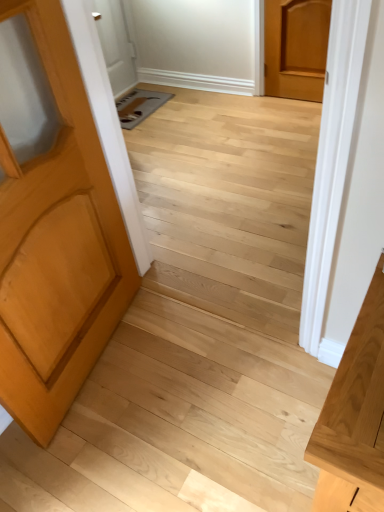
Question: Is the position of light brown wood door at left, positioned as the second door in back-to-front order, more distant than that of light wood vanity at right?

Choices:
 (A) no
 (B) yes

Answer: (A)

Question: From a real-world perspective, is light brown wood door at left, the 1th door viewed from the front, on light wood vanity at right?

Choices:
 (A) no
 (B) yes

Answer: (B)

Question: Is light brown wood door at left, positioned as the second door in back-to-front order, surrounding light wood vanity at right?

Choices:
 (A) yes
 (B) no

Answer: (B)

Question: Is light brown wood door at left, positioned as the second door in back-to-front order, oriented away from light wood vanity at right?

Choices:
 (A) yes
 (B) no

Answer: (B)

Question: Is light brown wood door at left, marked as the first door in a bottom-to-top arrangement, to the right of light wood vanity at right from the viewer's perspective?

Choices:
 (A) yes
 (B) no

Answer: (B)

Question: From the image's perspective, is light brown wood door at left, the 2th door positioned from the top, above or below light wood vanity at right?

Choices:
 (A) below
 (B) above

Answer: (B)

Question: Considering their positions, is light brown wood door at left, positioned as the second door in back-to-front order, located in front of or behind light wood vanity at right?

Choices:
 (A) front
 (B) behind

Answer: (A)

Question: In terms of height, does light brown wood door at left, the 1th door positioned from the left, look taller or shorter compared to light wood vanity at right?

Choices:
 (A) short
 (B) tall

Answer: (B)

Question: Considering the relative positions of light brown wood door at left, marked as the first door in a bottom-to-top arrangement, and light wood vanity at right in the image provided, is light brown wood door at left, marked as the first door in a bottom-to-top arrangement, to the left or to the right of light wood vanity at right?

Choices:
 (A) right
 (B) left

Answer: (B)

Question: Considering the relative positions of light brown wood door at upper right, acting as the first door starting from the back, and light wood vanity at right in the image provided, is light brown wood door at upper right, acting as the first door starting from the back, to the left or to the right of light wood vanity at right?

Choices:
 (A) left
 (B) right

Answer: (B)

Question: Based on their sizes in the image, would you say light brown wood door at upper right, the second door when ordered from front to back, is bigger or smaller than light wood vanity at right?

Choices:
 (A) big
 (B) small

Answer: (B)

Question: From a real-world perspective, relative to light wood vanity at right, is light brown wood door at upper right, acting as the first door starting from the back, vertically above or below?

Choices:
 (A) above
 (B) below

Answer: (A)

Question: From the image's perspective, is light brown wood door at upper right, arranged as the first door when viewed from the right, positioned above or below light wood vanity at right?

Choices:
 (A) below
 (B) above

Answer: (B)

Question: Is light brown wood door at upper right, arranged as the first door when viewed from the top, bigger or smaller than light brown wood door at left, arranged as the 2th door when viewed from the right?

Choices:
 (A) big
 (B) small

Answer: (B)

Question: From the image's perspective, is light brown wood door at upper right, marked as the second door in a bottom-to-top arrangement, located above or below light brown wood door at left, the 1th door viewed from the front?

Choices:
 (A) above
 (B) below

Answer: (A)